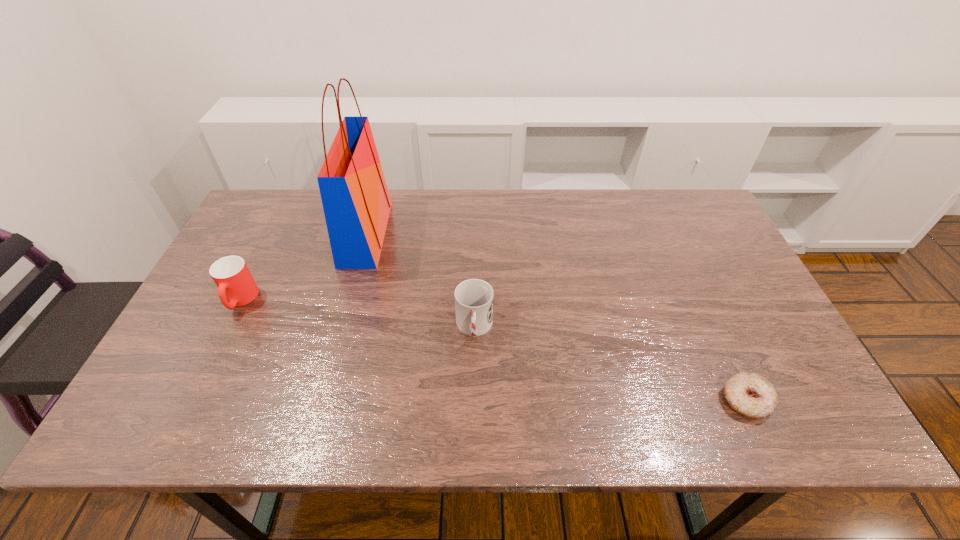
The height and width of the screenshot is (540, 960). What are the coordinates of `the tallest object` in the screenshot? It's located at (356, 202).

Image resolution: width=960 pixels, height=540 pixels. I want to click on shopping bag, so click(x=356, y=202).

Locate an element on the screen. This screenshot has width=960, height=540. the third object from left to right is located at coordinates click(x=473, y=298).

Image resolution: width=960 pixels, height=540 pixels. Identify the location of the left cup. (236, 287).

Locate an element on the screen. The image size is (960, 540). the nearest object is located at coordinates [x=749, y=394].

The width and height of the screenshot is (960, 540). I want to click on doughnut, so [x=749, y=394].

At what (x,y) coordinates should I click in order to perform the action: click on vacant region located on the handle side of the shopping bag. Please return your answer as a coordinate pair (x, y). This screenshot has width=960, height=540. Looking at the image, I should click on (406, 234).

At what (x,y) coordinates should I click in order to perform the action: click on blank space located 0.050m on the handle side of the third object from left to right. Please return your answer as a coordinate pair (x, y). Looking at the image, I should click on (474, 368).

The height and width of the screenshot is (540, 960). In order to click on free spot located on the side of the leftmost object with the handle in this screenshot , I will do `click(182, 415)`.

Image resolution: width=960 pixels, height=540 pixels. I want to click on free spot located on the right of the rightmost object, so click(794, 400).